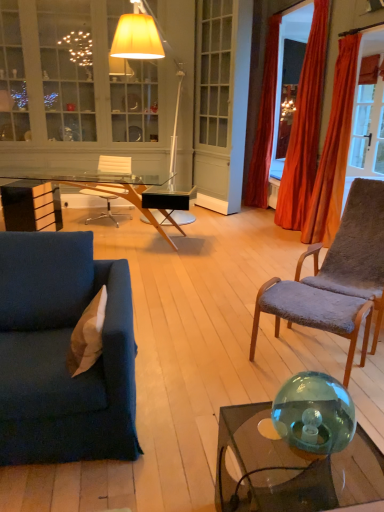
Question: From a real-world perspective, is gray plush chair at right, the 2th chair from the left, physically below transparent glass sphere at lower right?

Choices:
 (A) no
 (B) yes

Answer: (B)

Question: Is gray plush chair at right, positioned as the second chair in back-to-front order, not inside transparent glass sphere at lower right?

Choices:
 (A) yes
 (B) no

Answer: (A)

Question: Would you consider gray plush chair at right, arranged as the 1th chair when ordered from the bottom, to be distant from transparent glass sphere at lower right?

Choices:
 (A) no
 (B) yes

Answer: (B)

Question: From a real-world perspective, is gray plush chair at right, arranged as the 1th chair when ordered from the bottom, over transparent glass sphere at lower right?

Choices:
 (A) yes
 (B) no

Answer: (B)

Question: Is transparent glass sphere at lower right at the back of gray plush chair at right, the 2th chair from the left?

Choices:
 (A) yes
 (B) no

Answer: (B)

Question: From a real-world perspective, relative to transparent glass coffee table at lower right, is transparent glass desk at center vertically above or below?

Choices:
 (A) above
 (B) below

Answer: (A)

Question: In terms of width, does transparent glass desk at center look wider or thinner when compared to transparent glass coffee table at lower right?

Choices:
 (A) thin
 (B) wide

Answer: (B)

Question: Looking at the image, does transparent glass desk at center seem bigger or smaller compared to transparent glass coffee table at lower right?

Choices:
 (A) small
 (B) big

Answer: (B)

Question: Is transparent glass desk at center spatially inside transparent glass coffee table at lower right, or outside of it?

Choices:
 (A) outside
 (B) inside

Answer: (A)

Question: Is point (155, 178) closer or farther from the camera than point (347, 416)?

Choices:
 (A) closer
 (B) farther

Answer: (B)

Question: Is transparent glass desk at center taller or shorter than transparent glass sphere at lower right?

Choices:
 (A) short
 (B) tall

Answer: (B)

Question: From a real-world perspective, is transparent glass desk at center physically located above or below transparent glass sphere at lower right?

Choices:
 (A) above
 (B) below

Answer: (B)

Question: Is transparent glass desk at center in front of or behind transparent glass sphere at lower right in the image?

Choices:
 (A) front
 (B) behind

Answer: (B)

Question: Visually, is velvet orange curtain at right, positioned as the first curtain in back-to-front order, positioned to the left or to the right of matte white floor lamp at upper center?

Choices:
 (A) right
 (B) left

Answer: (A)

Question: From the image's perspective, relative to matte white floor lamp at upper center, is velvet orange curtain at right, marked as the third curtain in a front-to-back arrangement, above or below?

Choices:
 (A) above
 (B) below

Answer: (A)